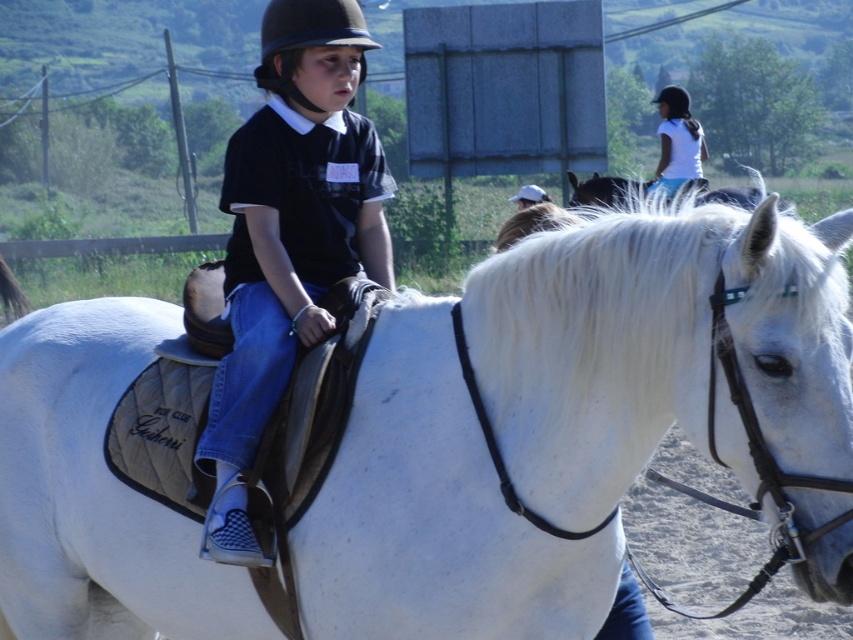
Question: Does black hard helmet at center appear on the left side of white matte shirt at upper center?

Choices:
 (A) no
 (B) yes

Answer: (B)

Question: Is black hard helmet at center closer to the viewer compared to black matte helmet at upper center?

Choices:
 (A) yes
 (B) no

Answer: (A)

Question: Based on their relative distances, which object is nearer to the white matte/suede saddle at center?

Choices:
 (A) black hard helmet at center
 (B) white matte shirt at upper center

Answer: (A)

Question: Which object is positioned closest to the black matte helmet at upper center?

Choices:
 (A) white matte shirt at upper center
 (B) white matte/suede saddle at center
 (C) black matte shirt at center
 (D) black hard helmet at center

Answer: (A)

Question: Is white matte shirt at upper center above black matte helmet at upper center?

Choices:
 (A) no
 (B) yes

Answer: (A)

Question: Which point is closer to the camera?

Choices:
 (A) click(685, 104)
 (B) click(288, 124)

Answer: (B)